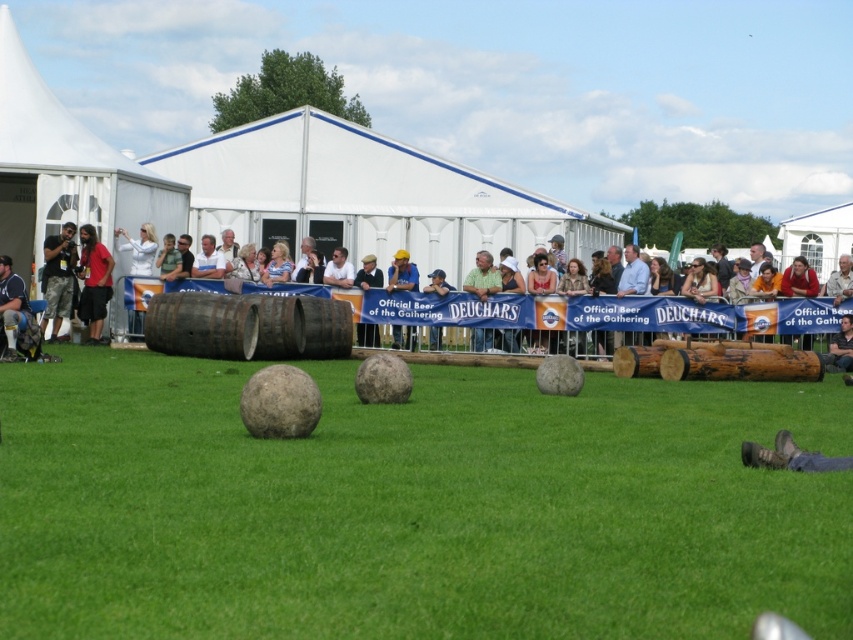
Question: Can you confirm if green grass at center is thinner than light brown wooden barrel at center?

Choices:
 (A) no
 (B) yes

Answer: (B)

Question: Which point is farther from the camera taking this photo?

Choices:
 (A) (32, 84)
 (B) (102, 324)
 (C) (399, 269)
 (D) (51, 244)

Answer: (A)

Question: Which of the following is the farthest from the observer?

Choices:
 (A) camouflage pants at left
 (B) matte black camera at left
 (C) green grass at center

Answer: (B)

Question: Can you confirm if camouflage pants at left is positioned above light brown wooden barrel at center?

Choices:
 (A) yes
 (B) no

Answer: (B)

Question: Is matte black camera at left positioned before light brown wooden barrel at center?

Choices:
 (A) yes
 (B) no

Answer: (A)

Question: Which point is farther to the camera?

Choices:
 (A) matte black camera at left
 (B) green grass at center

Answer: (A)